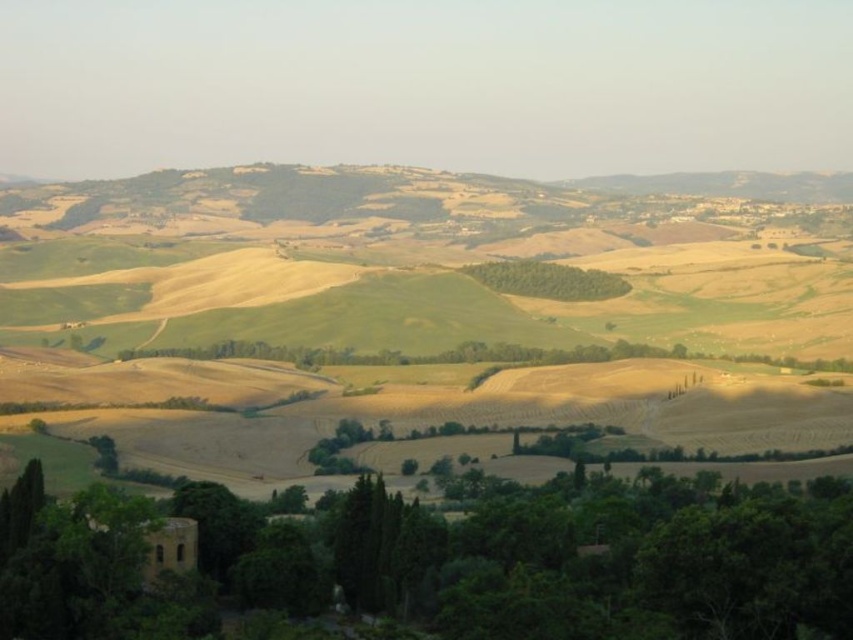
You are an architect planning to build a new garden in this Tuscan landscape. You want to place a small statue between the green leafy tree at lower center and the green leafy trees at center. Considering their sizes, which tree should the statue be closer to?

The statue should be closer to the green leafy trees at center because the green leafy tree at lower center is larger in size and might overshadow the statue if placed too close.